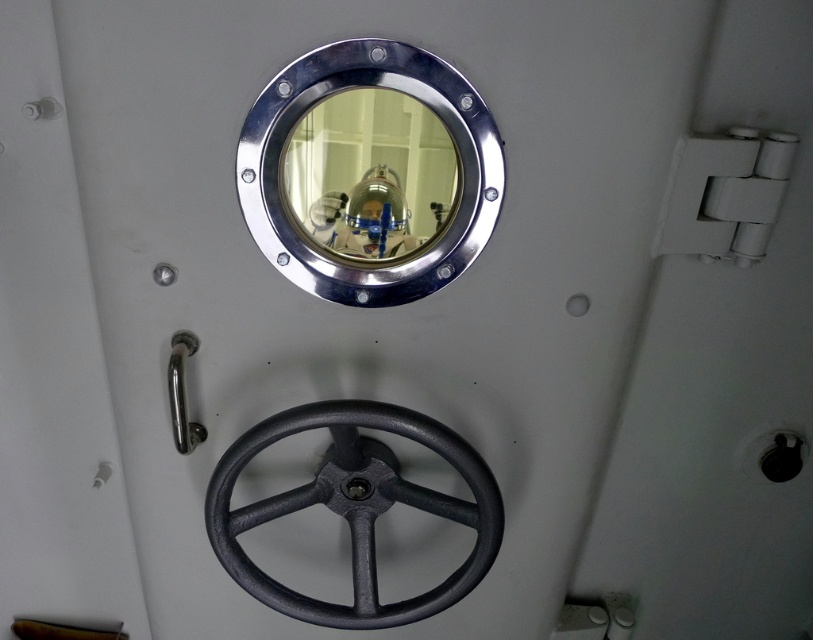
You are an astronaut inside a spacecraft and need to reach both the polished metal porthole at upper center and the black cast iron wheel at lower center. Which object is wider?

The polished metal porthole at upper center is less wide than the black cast iron wheel at lower center, so the black cast iron wheel at lower center is wider.

You are an astronaut inside a spacecraft and need to locate the black cast iron wheel at lower center. Based on the scene, where should you look relative to the polished metal porthole at upper center?

The polished metal porthole at upper center is to the right of the black cast iron wheel at lower center, so you should look to the left of the polished metal porthole at upper center to find the black cast iron wheel at lower center.

You are inside a submarine and need to locate the polished metal porthole at upper center. According to the scene description, where exactly is it positioned?

The polished metal porthole at upper center is located at point coordinates (368, 172).